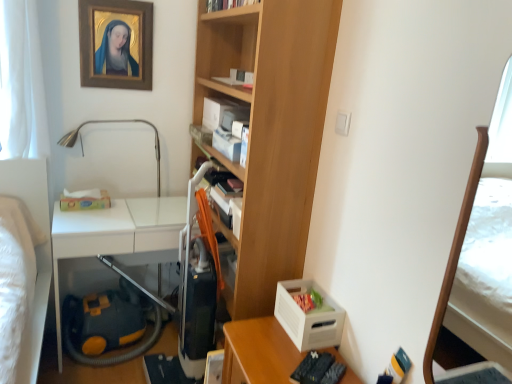
Question: Is wooden bookcase at center not within white sheer curtain at left?

Choices:
 (A) no
 (B) yes

Answer: (B)

Question: Is wooden bookcase at center closer to the viewer compared to white sheer curtain at left?

Choices:
 (A) no
 (B) yes

Answer: (B)

Question: From the image's perspective, is wooden bookcase at center over white sheer curtain at left?

Choices:
 (A) no
 (B) yes

Answer: (A)

Question: Considering the relative sizes of wooden bookcase at center and white sheer curtain at left in the image provided, is wooden bookcase at center taller than white sheer curtain at left?

Choices:
 (A) yes
 (B) no

Answer: (A)

Question: Considering the relative sizes of wooden bookcase at center and white sheer curtain at left in the image provided, is wooden bookcase at center shorter than white sheer curtain at left?

Choices:
 (A) yes
 (B) no

Answer: (B)

Question: Are wooden bookcase at center and white sheer curtain at left far apart?

Choices:
 (A) yes
 (B) no

Answer: (A)

Question: From a real-world perspective, is yellow-orange plastic vacuum cleaner at lower left positioned under white sheer curtain at left based on gravity?

Choices:
 (A) no
 (B) yes

Answer: (B)

Question: Is yellow-orange plastic vacuum cleaner at lower left bigger than white sheer curtain at left?

Choices:
 (A) yes
 (B) no

Answer: (A)

Question: Is yellow-orange plastic vacuum cleaner at lower left not inside white sheer curtain at left?

Choices:
 (A) yes
 (B) no

Answer: (A)

Question: Is yellow-orange plastic vacuum cleaner at lower left closer to camera compared to white sheer curtain at left?

Choices:
 (A) no
 (B) yes

Answer: (A)

Question: Is yellow-orange plastic vacuum cleaner at lower left beside white sheer curtain at left?

Choices:
 (A) yes
 (B) no

Answer: (B)

Question: From the image's perspective, is yellow-orange plastic vacuum cleaner at lower left on white sheer curtain at left?

Choices:
 (A) no
 (B) yes

Answer: (A)

Question: Is wooden desk at lower right bigger than wooden bookcase at center?

Choices:
 (A) yes
 (B) no

Answer: (B)